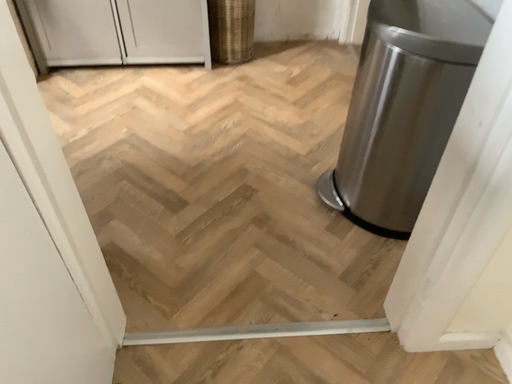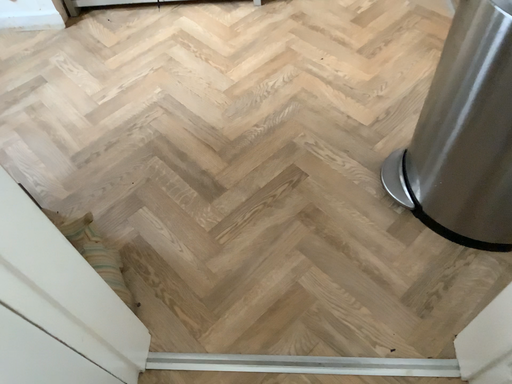
Question: Which way did the camera rotate in the video?

Choices:
 (A) rotated left
 (B) rotated right

Answer: (A)